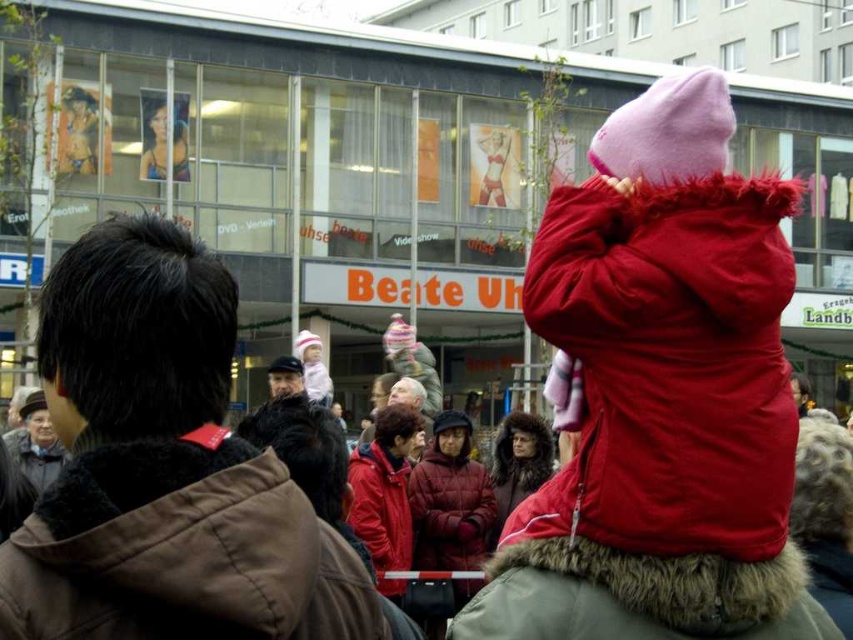
You are a photographer standing at the center of the scene. You want to take a photo of the velvet red coat at upper right and the red matte jacket at center. What is the minimum distance you need to move to ensure both are in frame?

The velvet red coat at upper right is 12.57 meters away from the red matte jacket at center. To capture both in the same frame, you need to position yourself such that the distance between them is within your camera lens range. However, since the exact focal length isnecessary to calculate the required distance, the minimum distance you need to move depends on your camera settings. Without specific lens details, it is not possible to determine an exact measurement.